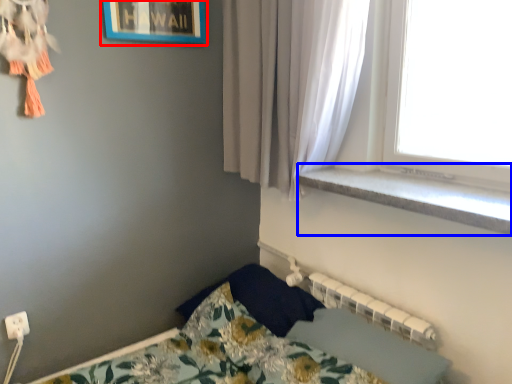
Question: Which of the following is the farthest to the observer, picture frame (highlighted by a red box) or window sill (highlighted by a blue box)?

Choices:
 (A) picture frame
 (B) window sill

Answer: (A)